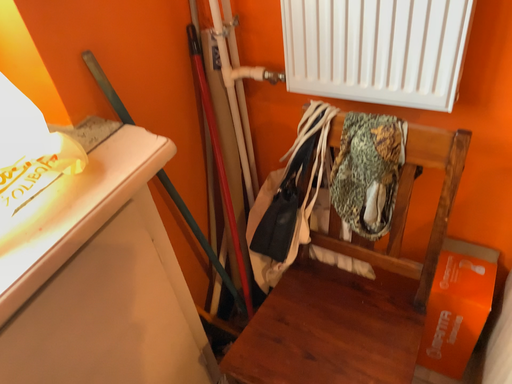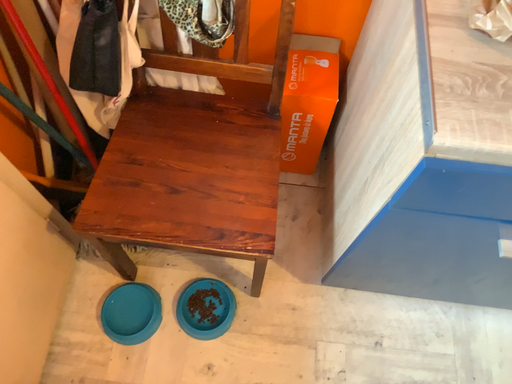
Question: Which way did the camera rotate in the video?

Choices:
 (A) rotated upward
 (B) rotated downward

Answer: (B)